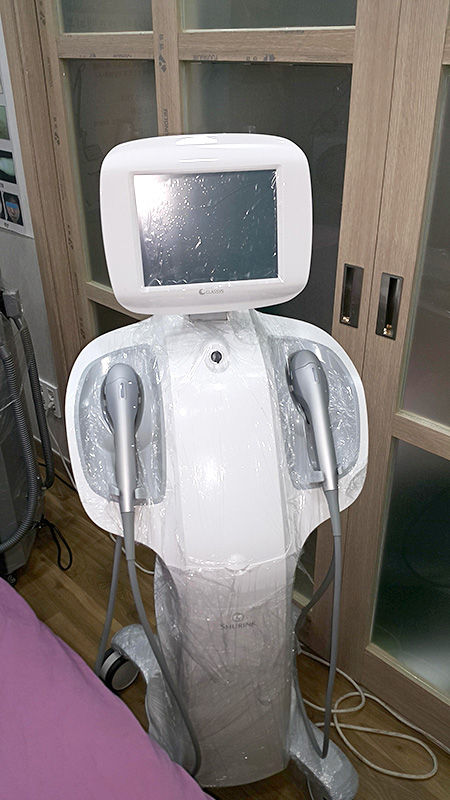
The image size is (450, 800). In order to click on wood paneled floor in this screenshot , I will do `click(85, 593)`.